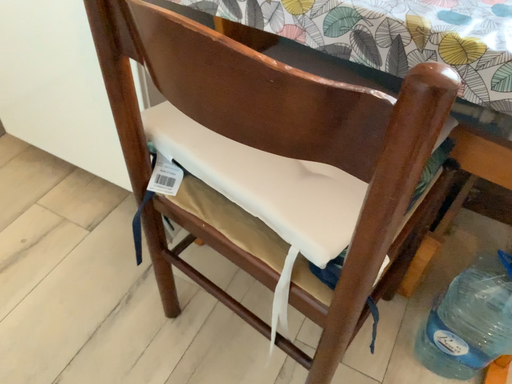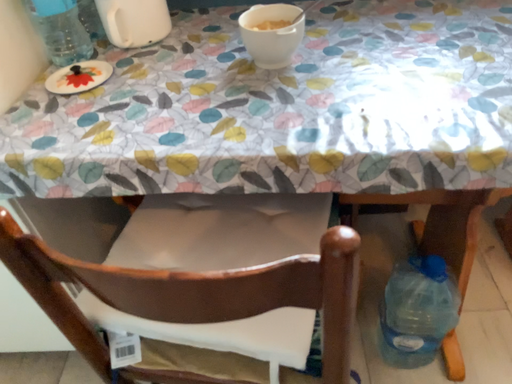
Question: Which way did the camera rotate in the video?

Choices:
 (A) rotated left
 (B) rotated right

Answer: (B)